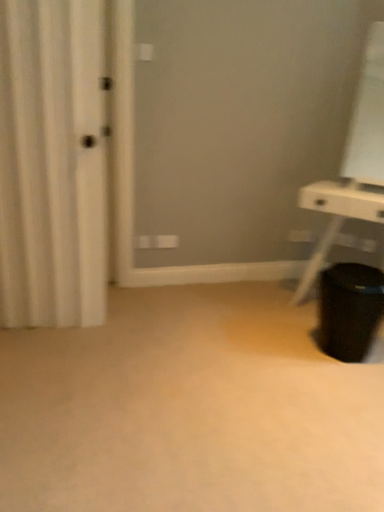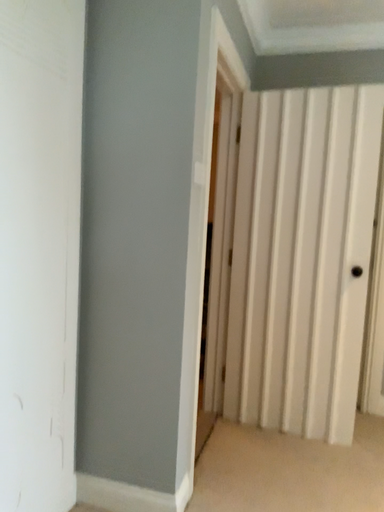
Question: Which way did the camera rotate in the video?

Choices:
 (A) rotated left
 (B) rotated right

Answer: (A)